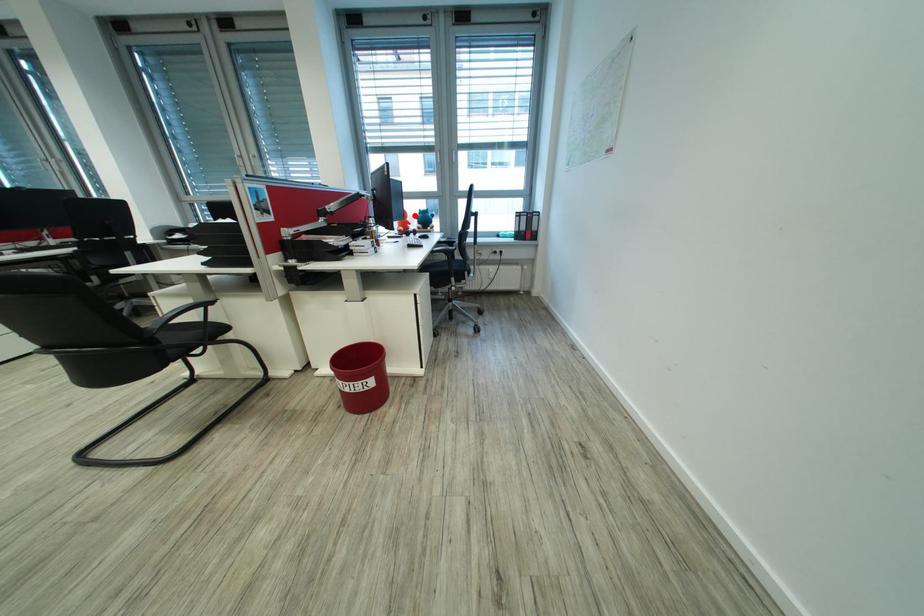
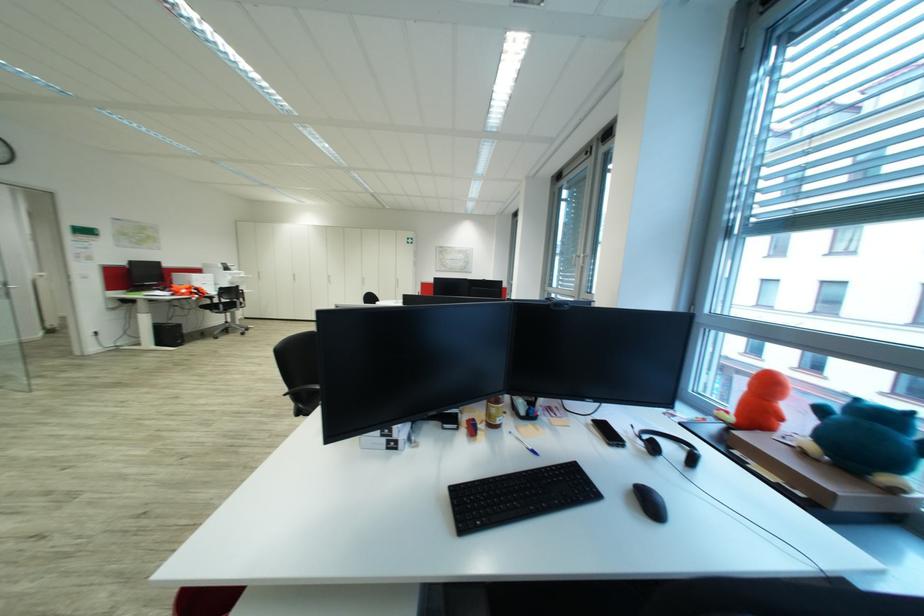
Question: I am providing you with two images of the same scene from different viewpoints. In image1, a red point is highlighted. Considering the same 3D point in image2, which of the following is correct?

Choices:
 (A) It is closer
 (B) It is farther

Answer: (B)